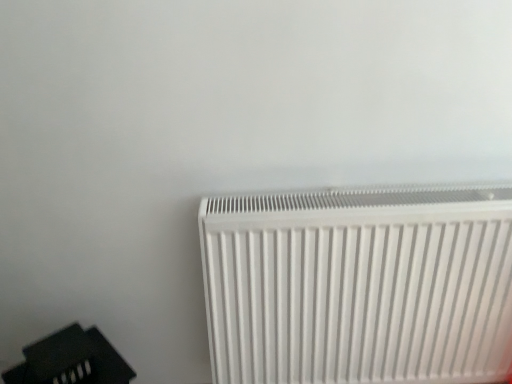
Question: Does black plastic speaker at lower left appear on the left side of white plastic radiator at lower right?

Choices:
 (A) no
 (B) yes

Answer: (B)

Question: From a real-world perspective, is black plastic speaker at lower left located beneath white plastic radiator at lower right?

Choices:
 (A) no
 (B) yes

Answer: (B)

Question: From the image's perspective, is black plastic speaker at lower left located above white plastic radiator at lower right?

Choices:
 (A) yes
 (B) no

Answer: (B)

Question: Is black plastic speaker at lower left touching white plastic radiator at lower right?

Choices:
 (A) no
 (B) yes

Answer: (A)

Question: Is black plastic speaker at lower left aimed at white plastic radiator at lower right?

Choices:
 (A) yes
 (B) no

Answer: (B)

Question: Considering the relative sizes of black plastic speaker at lower left and white plastic radiator at lower right in the image provided, is black plastic speaker at lower left bigger than white plastic radiator at lower right?

Choices:
 (A) yes
 (B) no

Answer: (B)

Question: Is white plastic radiator at lower right thinner than black plastic speaker at lower left?

Choices:
 (A) no
 (B) yes

Answer: (B)

Question: From the image's perspective, is white plastic radiator at lower right on top of black plastic speaker at lower left?

Choices:
 (A) no
 (B) yes

Answer: (B)

Question: Considering the relative sizes of white plastic radiator at lower right and black plastic speaker at lower left in the image provided, is white plastic radiator at lower right smaller than black plastic speaker at lower left?

Choices:
 (A) no
 (B) yes

Answer: (A)

Question: Does white plastic radiator at lower right appear on the right side of black plastic speaker at lower left?

Choices:
 (A) no
 (B) yes

Answer: (B)

Question: Is the depth of white plastic radiator at lower right greater than that of black plastic speaker at lower left?

Choices:
 (A) no
 (B) yes

Answer: (B)

Question: Is white plastic radiator at lower right not within black plastic speaker at lower left?

Choices:
 (A) no
 (B) yes

Answer: (B)

Question: Looking at their shapes, would you say white plastic radiator at lower right is wider or thinner than black plastic speaker at lower left?

Choices:
 (A) thin
 (B) wide

Answer: (A)